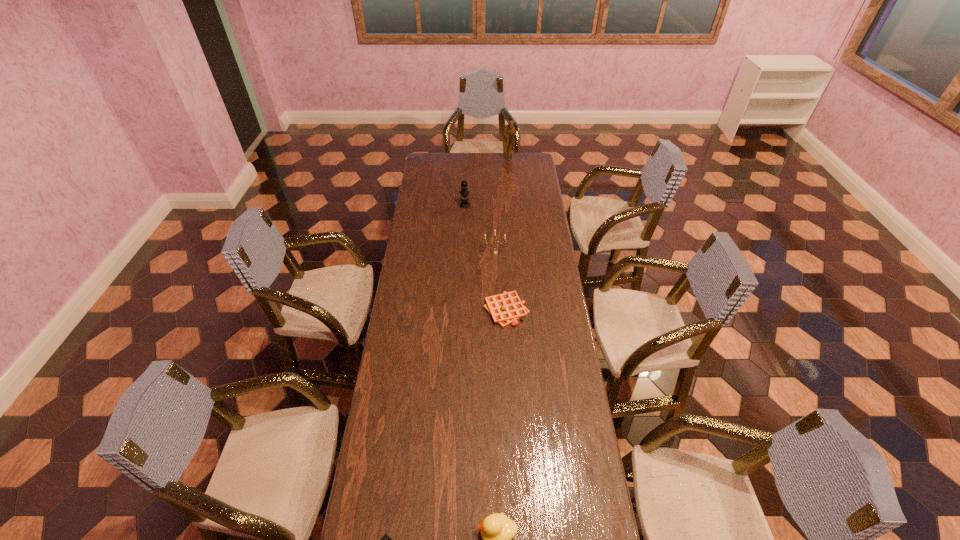
At what (x,y) coordinates should I click in order to perform the action: click on vacant space located 0.380m on the front of the third nearest object. Please return your answer as a coordinate pair (x, y). Looking at the image, I should click on (512, 412).

Identify the location of object at the far edge. (509, 132).

Identify the location of figurine positioned at the right edge. (509, 132).

What are the coordinates of `waffle that is at the right edge` in the screenshot? It's located at (506, 308).

Locate an element on the screen. The height and width of the screenshot is (540, 960). object that is positioned at the far right corner is located at coordinates (509, 132).

The height and width of the screenshot is (540, 960). In the image, there is a desktop. In order to click on blank space at the left edge in this screenshot , I will do `click(409, 253)`.

You are a GUI agent. You are given a task and a screenshot of the screen. Output one action in this format:
    pyautogui.click(x=<x>, y=<y>)
    Task: Click on the vacant space at the right edge
    This screenshot has width=960, height=540.
    Given the screenshot: What is the action you would take?
    pyautogui.click(x=559, y=343)

Identify the location of vacant point located between the fifth tallest object and the tallest object. (507, 235).

Locate an element on the screen. Image resolution: width=960 pixels, height=540 pixels. vacant space in between the candle and the fifth object from right to left is located at coordinates (480, 228).

You are a GUI agent. You are given a task and a screenshot of the screen. Output one action in this format:
    pyautogui.click(x=<x>, y=<y>)
    Task: Click on the vacant space in between the second object from left to right and the farthest object
    
    Given the screenshot: What is the action you would take?
    pyautogui.click(x=487, y=183)